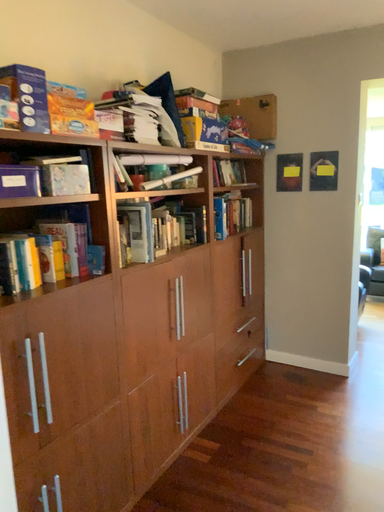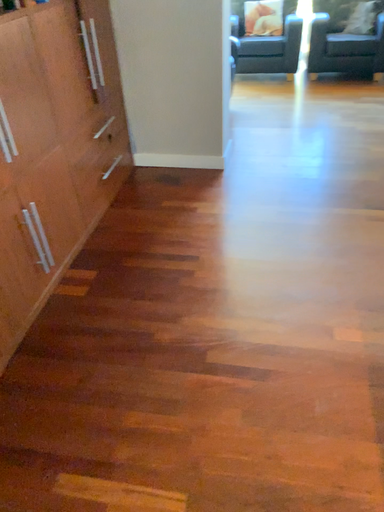
Question: Which way did the camera rotate in the video?

Choices:
 (A) rotated right
 (B) rotated left

Answer: (A)